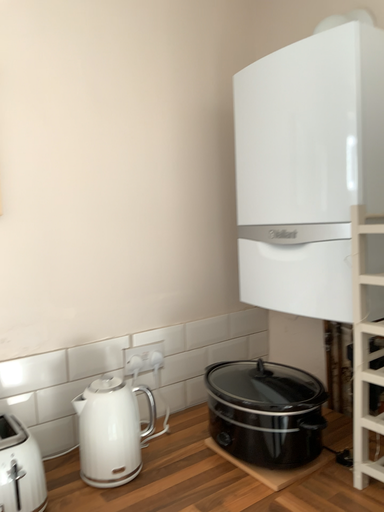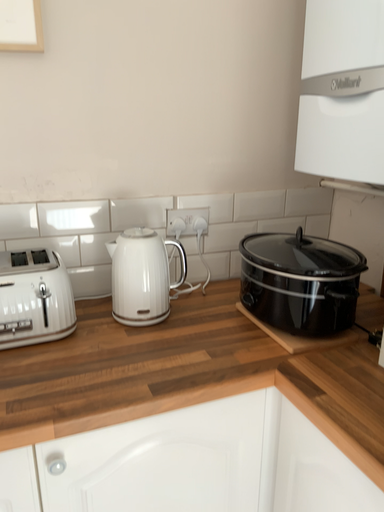
Question: Which way did the camera rotate in the video?

Choices:
 (A) rotated right
 (B) rotated left

Answer: (B)